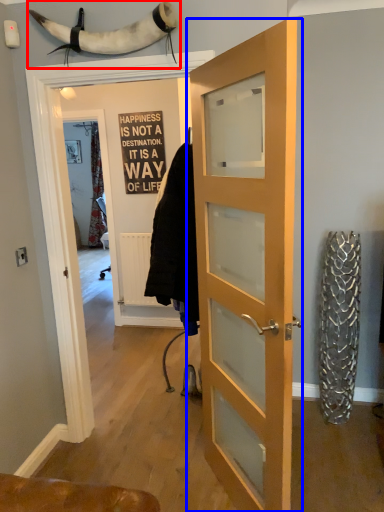
Question: Which object is further to the camera taking this photo, animal (highlighted by a red box) or door (highlighted by a blue box)?

Choices:
 (A) animal
 (B) door

Answer: (A)